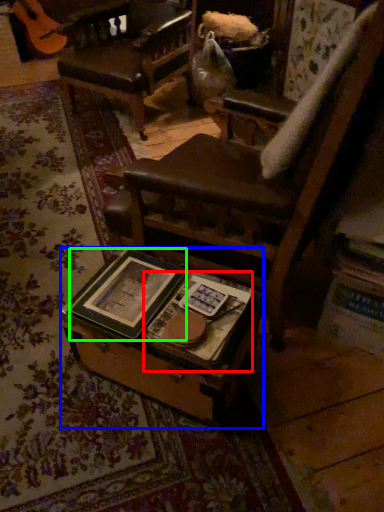
Question: Based on their relative distances, which object is farther from paperback book (highlighted by a red box)? Choose from table (highlighted by a blue box) and paperback book (highlighted by a green box).

Choices:
 (A) table
 (B) paperback book

Answer: (B)